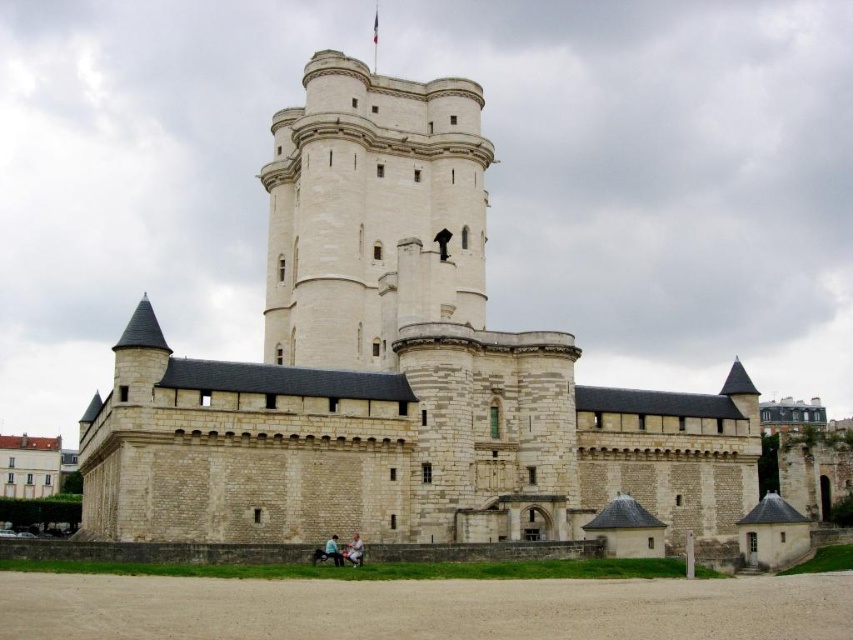
At what (x,y) coordinates should I click in order to perform the action: click on white stone castle at center. Please return your answer as a coordinate pair (x, y). The height and width of the screenshot is (640, 853). Looking at the image, I should click on (395, 369).

Between point (479, 378) and point (347, 554), which one is positioned in front?

Positioned in front is point (347, 554).

Is point (467, 188) positioned before point (360, 557)?

No, it is not.

In order to click on white stone castle at center in this screenshot , I will do `click(395, 369)`.

This screenshot has height=640, width=853. I want to click on white stone castle at center, so click(x=395, y=369).

Between point (694, 538) and point (326, 554), which one is positioned in front?

Point (326, 554)

What do you see at coordinates (395, 369) in the screenshot? I see `white stone castle at center` at bounding box center [395, 369].

Image resolution: width=853 pixels, height=640 pixels. What are the coordinates of `white stone castle at center` in the screenshot? It's located at (395, 369).

Can you confirm if white stone tower at center is positioned to the right of light brown leather jacket at lower center?

In fact, white stone tower at center is to the left of light brown leather jacket at lower center.

Is the position of white stone tower at center less distant than that of light brown leather jacket at lower center?

No, it is not.

Between point (351, 138) and point (334, 554), which one is positioned behind?

The point (351, 138) is more distant.

This screenshot has height=640, width=853. I want to click on white stone tower at center, so click(x=369, y=209).